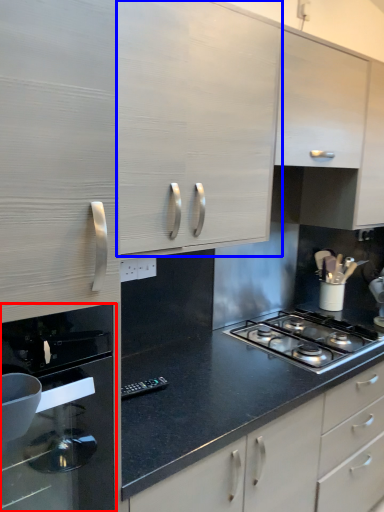
Question: Which point is closer to the camera, home appliance (highlighted by a red box) or cabinetry (highlighted by a blue box)?

Choices:
 (A) home appliance
 (B) cabinetry

Answer: (A)